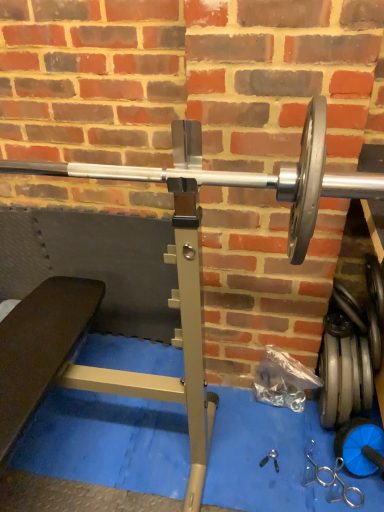
Question: Is blue rubber dumbbell at lower right, arranged as the first dumbbell when ordered from the bottom, spatially inside silver metallic dumbbell at lower right, placed as the first dumbbell when sorted from top to bottom, or outside of it?

Choices:
 (A) inside
 (B) outside

Answer: (B)

Question: Visually, is blue rubber dumbbell at lower right, the second dumbbell viewed from the top, positioned to the left or to the right of silver metallic dumbbell at lower right, placed as the first dumbbell when sorted from top to bottom?

Choices:
 (A) right
 (B) left

Answer: (A)

Question: Considering the real-world distances, which object is closest to the silver metallic barbell at center?

Choices:
 (A) blue rubber dumbbell at lower right, arranged as the first dumbbell when ordered from the bottom
 (B) silver metallic dumbbell at lower right, the second dumbbell ordered from the bottom

Answer: (B)

Question: Based on their relative distances, which object is nearer to the silver metallic dumbbell at lower right, placed as the first dumbbell when sorted from top to bottom?

Choices:
 (A) blue rubber dumbbell at lower right, the second dumbbell viewed from the top
 (B) silver metallic barbell at center

Answer: (A)